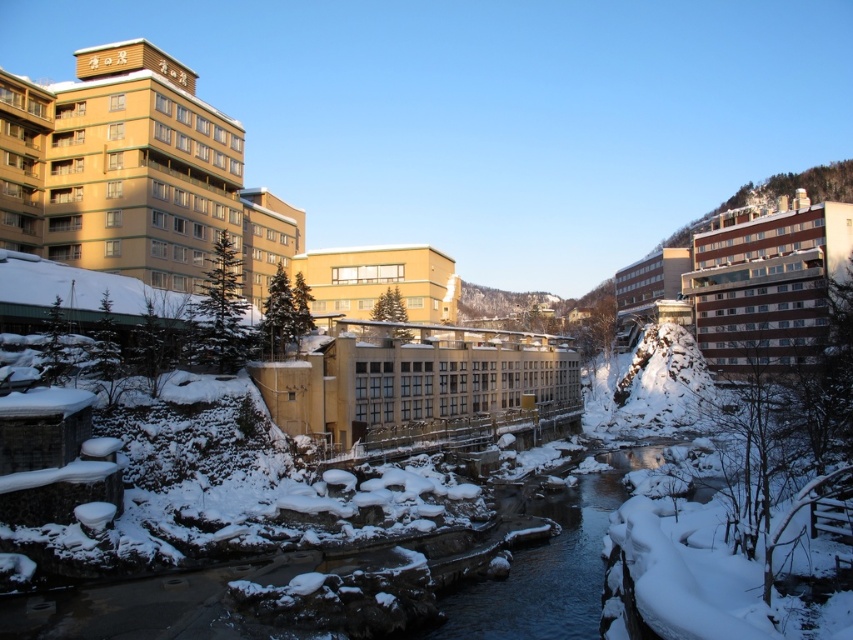
You are standing at the origin point of the coordinate system in this winter scene. You want to walk towards the beige concrete building at center. What direction should you head in?

Since the beige concrete building at center is located at coordinate point 0.598 in the x direction and 0.490 in the y direction, you should head northeast to reach it.

You are standing at the point with coordinates point (134, 173) in the winter scene. What object are you standing on?

You are standing on the matte yellow building at upper left.

You are standing in the winter scene and want to take a photo of both the beige concrete building at center and the matte yellow building at center. Since you can only frame one building in the center of your camera viewfinder at a time, which building should you adjust your camera to focus on first if you want to capture the other building in the background?

You should first focus on the matte yellow building at center because the beige concrete building at center is to the right of it, so by centering the matte yellow building, the beige concrete building at center will appear in the right background.